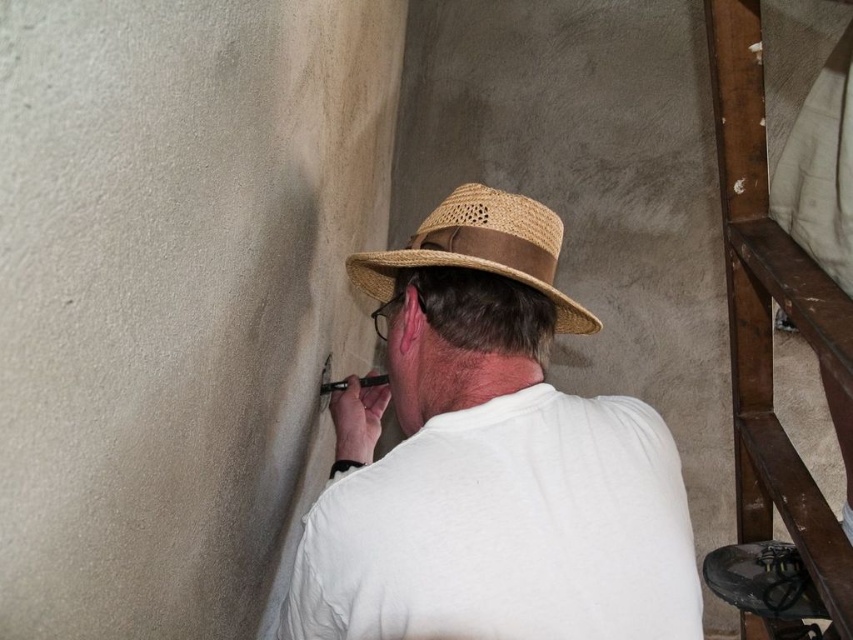
Question: Observing the image, what is the correct spatial positioning of white matte shirt at center in reference to straw hat at center?

Choices:
 (A) above
 (B) below

Answer: (B)

Question: Does white matte shirt at center appear on the left side of straw hat at center?

Choices:
 (A) yes
 (B) no

Answer: (A)

Question: Which point is closer to the camera?

Choices:
 (A) (474, 198)
 (B) (531, 234)

Answer: (B)

Question: Observing the image, what is the correct spatial positioning of white matte shirt at center in reference to straw hat at center?

Choices:
 (A) right
 (B) left

Answer: (B)